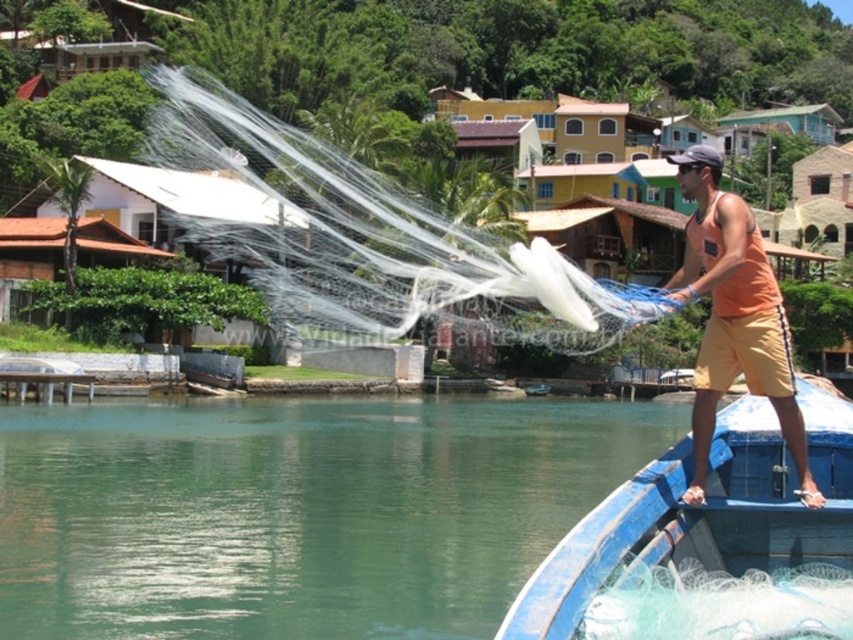
Is the position of green translucent water at lower left less distant than that of orange cotton tank top at right?

No, it is behind orange cotton tank top at right.

Who is higher up, green translucent water at lower left or orange cotton tank top at right?

orange cotton tank top at right is above.

The image size is (853, 640). In order to click on green translucent water at lower left in this screenshot , I will do `click(299, 512)`.

Find the location of a particular element. The image size is (853, 640). green translucent water at lower left is located at coordinates pyautogui.click(x=299, y=512).

Between green translucent water at lower left and transparent nylon fishing net at center, which one appears on the left side from the viewer's perspective?

green translucent water at lower left

What do you see at coordinates (299, 512) in the screenshot?
I see `green translucent water at lower left` at bounding box center [299, 512].

Is point (85, 497) closer to viewer compared to point (410, 250)?

Yes, it is in front of point (410, 250).

In order to click on green translucent water at lower left in this screenshot , I will do `click(299, 512)`.

Is green translucent water at lower left bigger than blue painted wood boat at right?

Indeed, green translucent water at lower left has a larger size compared to blue painted wood boat at right.

This screenshot has height=640, width=853. Find the location of `green translucent water at lower left`. green translucent water at lower left is located at coordinates (299, 512).